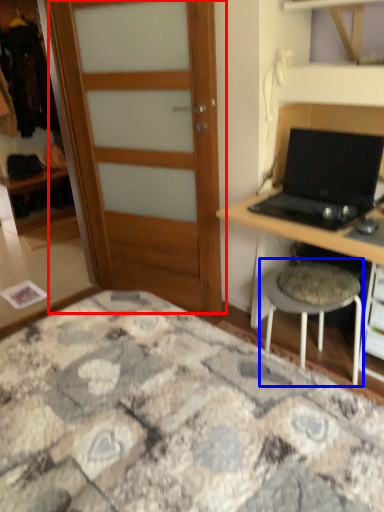
Question: Which of the following is the closest to the observer, door (highlighted by a red box) or stool (highlighted by a blue box)?

Choices:
 (A) door
 (B) stool

Answer: (B)